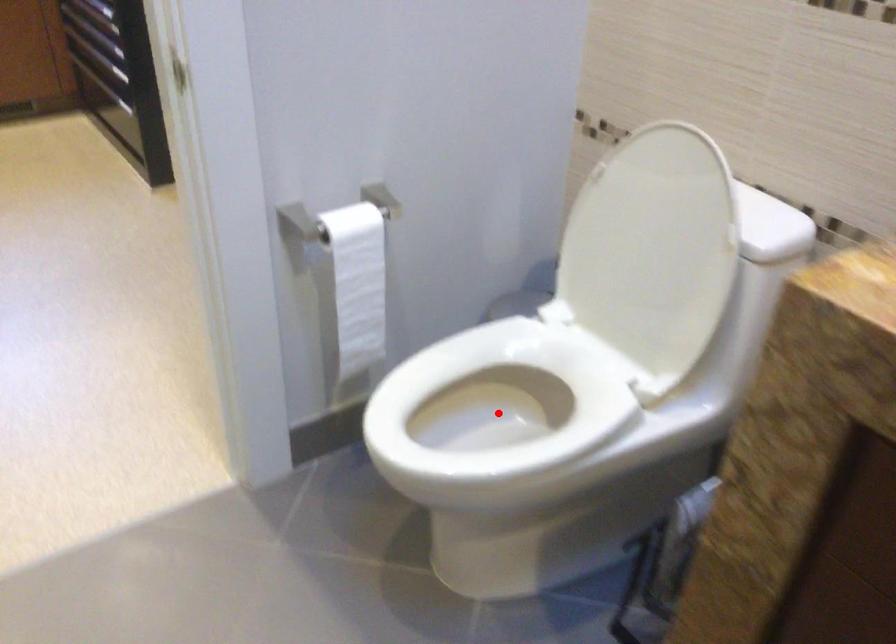
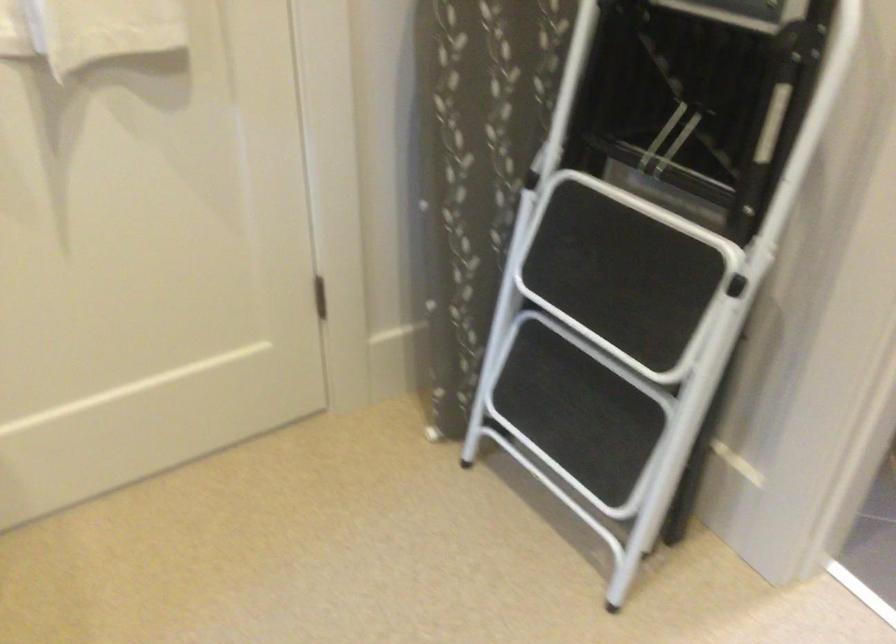
Question: I am providing you with two images of the same scene from different viewpoints. A red point is marked on the first image. Is the red point's position out of view in image 2?

Choices:
 (A) Yes
 (B) No

Answer: (A)